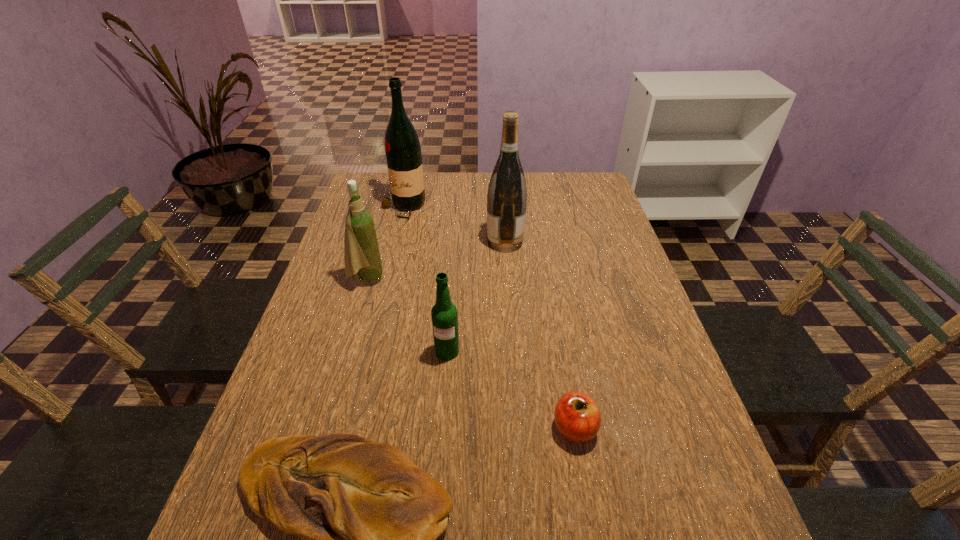
This screenshot has height=540, width=960. I want to click on free location at the far left corner, so click(377, 193).

You are a GUI agent. You are given a task and a screenshot of the screen. Output one action in this format:
    pyautogui.click(x=<x>, y=<y>)
    Task: Click on the blank space at the far right corner of the desktop
    The width and height of the screenshot is (960, 540).
    Given the screenshot: What is the action you would take?
    pyautogui.click(x=591, y=191)

The image size is (960, 540). What are the coordinates of `free spot between the farthest object and the third nearest object` in the screenshot? It's located at (425, 280).

This screenshot has height=540, width=960. In order to click on unoccupied position between the apple and the farthest wine bottle in this screenshot , I will do `click(489, 318)`.

Where is `free space between the second farthest wine bottle and the farthest wine bottle`? free space between the second farthest wine bottle and the farthest wine bottle is located at coordinates (454, 225).

Locate an element on the screen. free space between the rightmost wine bottle and the farthest wine bottle is located at coordinates (454, 225).

The width and height of the screenshot is (960, 540). Identify the location of free space between the fourth farthest object and the third tallest object. (407, 315).

The height and width of the screenshot is (540, 960). I want to click on free space between the third shortest object and the farthest wine bottle, so click(425, 280).

Find the location of a particular element. The width and height of the screenshot is (960, 540). vacant space that's between the farthest wine bottle and the fifth nearest object is located at coordinates (454, 225).

At what (x,y) coordinates should I click in order to perform the action: click on vacant region between the third shortest object and the apple. Please return your answer as a coordinate pair (x, y). This screenshot has width=960, height=540. Looking at the image, I should click on (511, 390).